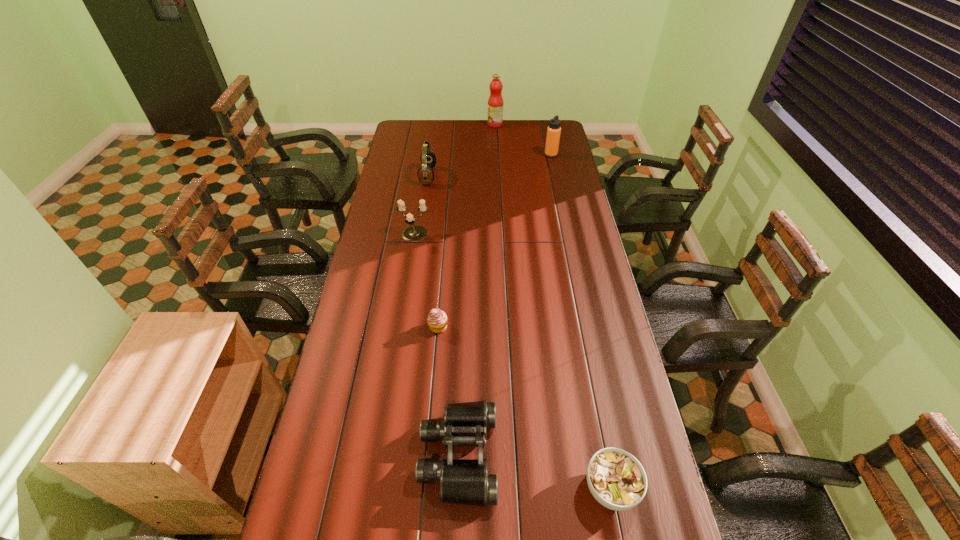
Find the location of a particular element. This screenshot has height=540, width=960. thermos bottle located in the right edge section of the desktop is located at coordinates (553, 130).

You are a GUI agent. You are given a task and a screenshot of the screen. Output one action in this format:
    pyautogui.click(x=<x>, y=<y>)
    Task: Click on the soup bowl present at the right edge
    
    Given the screenshot: What is the action you would take?
    pyautogui.click(x=616, y=479)

You are a GUI agent. You are given a task and a screenshot of the screen. Output one action in this format:
    pyautogui.click(x=<x>, y=<y>)
    Task: Click on the vacant space at the far edge
    
    Given the screenshot: What is the action you would take?
    pyautogui.click(x=511, y=120)

Where is `vacant space at the left edge of the desktop`? vacant space at the left edge of the desktop is located at coordinates (368, 278).

Where is `free space at the right edge of the desktop`? The width and height of the screenshot is (960, 540). free space at the right edge of the desktop is located at coordinates (612, 348).

I want to click on blank space at the far left corner, so click(x=407, y=133).

The width and height of the screenshot is (960, 540). I want to click on vacant space that is in between the tallest object and the headset, so click(462, 150).

At what (x,y) coordinates should I click in order to perform the action: click on empty space that is in between the third shortest object and the soup bowl. Please return your answer as a coordinate pair (x, y). This screenshot has width=960, height=540. Looking at the image, I should click on click(535, 472).

The height and width of the screenshot is (540, 960). Find the location of `free space that is in between the cupcake and the tallest object`. free space that is in between the cupcake and the tallest object is located at coordinates (467, 226).

You are a GUI agent. You are given a task and a screenshot of the screen. Output one action in this format:
    pyautogui.click(x=<x>, y=<y>)
    Task: Click on the free space between the fifth farthest object and the fifth tallest object
    This screenshot has height=540, width=960.
    Given the screenshot: What is the action you would take?
    pyautogui.click(x=448, y=392)